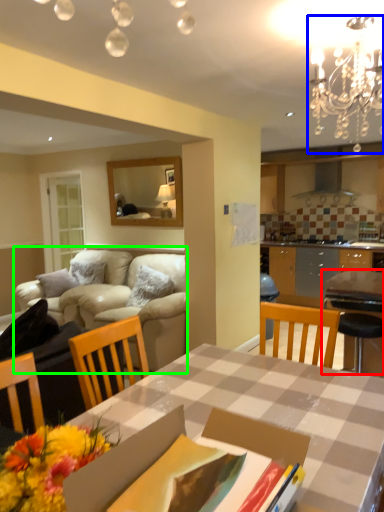
Question: Which object is the farthest from table (highlighted by a red box)? Choose among these: light fixture (highlighted by a blue box) or studio couch (highlighted by a green box).

Choices:
 (A) light fixture
 (B) studio couch

Answer: (B)